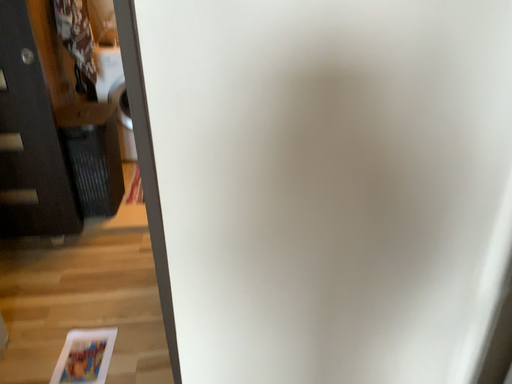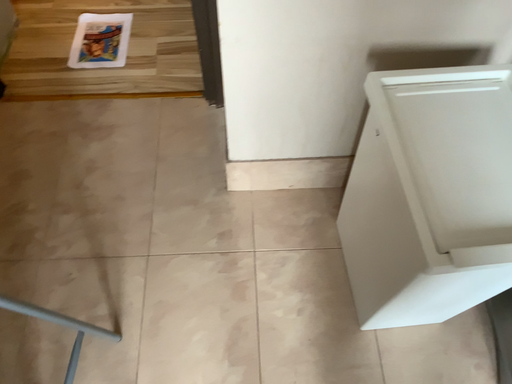
Question: How did the camera likely rotate when shooting the video?

Choices:
 (A) rotated downward
 (B) rotated upward

Answer: (A)